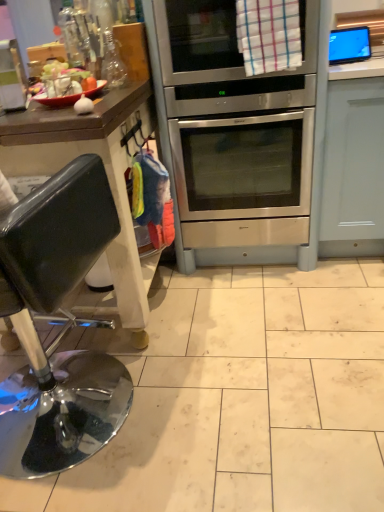
Find the location of a particular element. The height and width of the screenshot is (512, 384). spots to the right of shiny black stool at left is located at coordinates (216, 393).